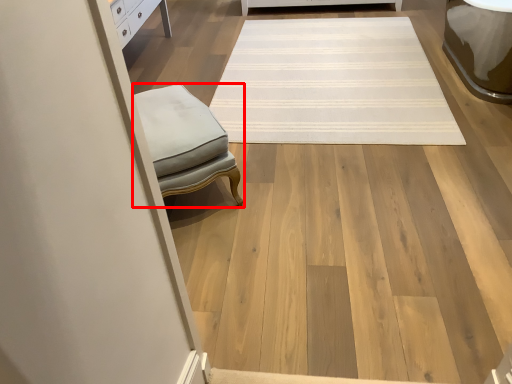
Question: In this image, where is furniture (annotated by the red box) located relative to mat?

Choices:
 (A) right
 (B) left

Answer: (B)